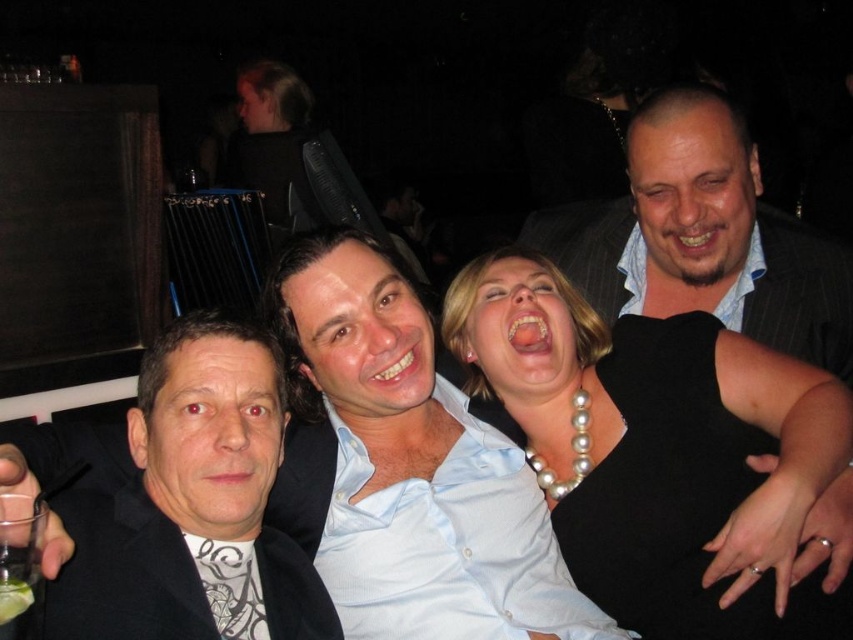
Can you confirm if pearl necklace at center is positioned to the right of black matte jacket at left?

Yes, pearl necklace at center is to the right of black matte jacket at left.

Does pearl necklace at center appear under black matte jacket at left?

Incorrect, pearl necklace at center is not positioned below black matte jacket at left.

Which is behind, point (763, 380) or point (259, 552)?

The point (763, 380) is more distant.

Identify the location of pearl necklace at center. (653, 444).

Is light blue shirt at center above black matte jacket at left?

No, light blue shirt at center is not above black matte jacket at left.

Measure the distance from light blue shirt at center to black matte jacket at left.

light blue shirt at center is 8.09 inches from black matte jacket at left.

Which is in front, point (401, 540) or point (80, 545)?

Point (80, 545) is more forward.

At what (x,y) coordinates should I click in order to perform the action: click on light blue shirt at center. Please return your answer as a coordinate pair (x, y). Image resolution: width=853 pixels, height=640 pixels. Looking at the image, I should click on (405, 467).

Is point (316, 280) less distant than point (12, 609)?

No, (316, 280) is further to viewer.

Is light blue shirt at center shorter than green translucent glass at lower left?

No.

Between point (412, 314) and point (30, 611), which one is positioned in front?

Point (30, 611)

The width and height of the screenshot is (853, 640). I want to click on light blue shirt at center, so click(405, 467).